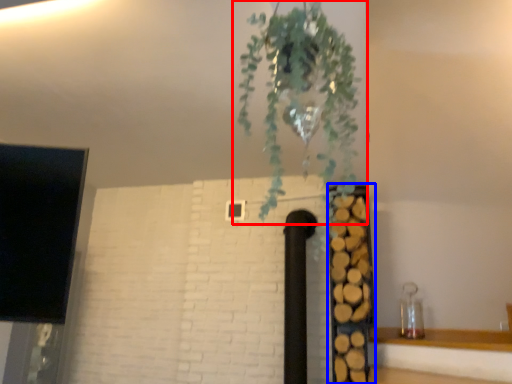
Question: Among these objects, which one is farthest to the camera, houseplant (highlighted by a red box) or shelf (highlighted by a blue box)?

Choices:
 (A) houseplant
 (B) shelf

Answer: (B)